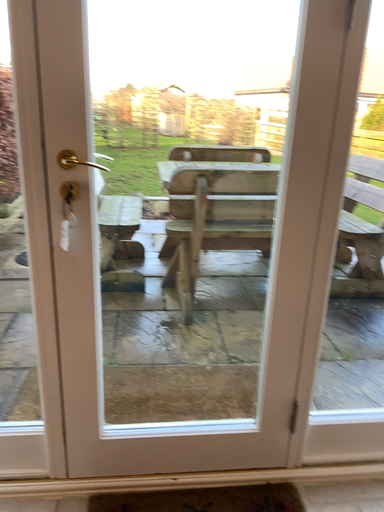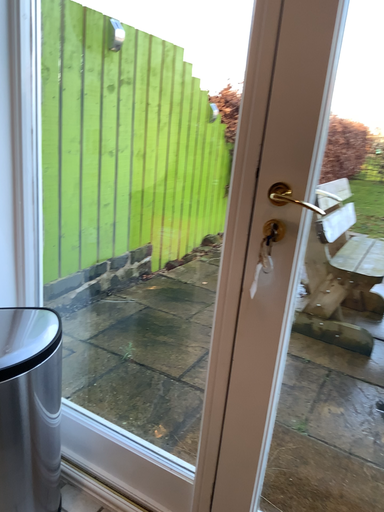
Question: Which way did the camera rotate in the video?

Choices:
 (A) rotated upward
 (B) rotated downward

Answer: (A)